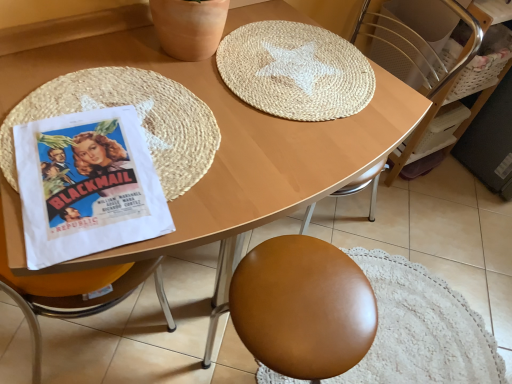
At what (x,y) coordinates should I click in order to perform the action: click on wooden at upper center. Please return your answer as a coordinate pair (x, y). Looking at the image, I should click on (417, 46).

In order to face natural fiber mat at upper center, arranged as the first mat when viewed from the right, should I rotate leftwards or rightwards?

To face it directly, rotate right by 5.818 degrees.

Locate an element on the screen. woven straw placemat at left, which ranks as the 2th mat in right-to-left order is located at coordinates (138, 116).

The width and height of the screenshot is (512, 384). I want to click on wooden at upper center, so click(x=417, y=46).

Is natural fiber mat at upper center, the second mat positioned from the left, oriented towards white woven basket at upper right?

No, natural fiber mat at upper center, the second mat positioned from the left, is not oriented towards white woven basket at upper right.

Considering the relative sizes of natural fiber mat at upper center, the second mat positioned from the left, and white woven basket at upper right in the image provided, is natural fiber mat at upper center, the second mat positioned from the left, wider than white woven basket at upper right?

Correct, the width of natural fiber mat at upper center, the second mat positioned from the left, exceeds that of white woven basket at upper right.

Is white woven basket at upper right surrounded by natural fiber mat at upper center, the second mat positioned from the left?

No, white woven basket at upper right is not inside natural fiber mat at upper center, the second mat positioned from the left.

Considering the points (305, 88) and (484, 81), which point is in front, point (305, 88) or point (484, 81)?

The point (305, 88) is closer.

Is wooden at upper center surrounded by woven straw placemat at left, the first mat from the left?

No, wooden at upper center is located outside of woven straw placemat at left, the first mat from the left.

From the image's perspective, which one is positioned higher, woven straw placemat at left, which ranks as the 2th mat in right-to-left order, or wooden at upper center?

wooden at upper center, from the image's perspective.

From their relative heights in the image, would you say white woven basket at upper right is taller or shorter than white paper poster at left?

In the image, white woven basket at upper right appears to be taller than white paper poster at left.

Looking at this image, is white woven basket at upper right looking in the opposite direction of white paper poster at left?

No, white woven basket at upper right's orientation is not away from white paper poster at left.

Can you confirm if white woven basket at upper right is positioned to the left of white paper poster at left?

No, white woven basket at upper right is not to the left of white paper poster at left.

Considering the sizes of white woven basket at upper right and white paper poster at left in the image, is white woven basket at upper right wider or thinner than white paper poster at left?

Clearly, white woven basket at upper right has less width compared to white paper poster at left.

Looking at this image, is white woven basket at upper right next to woven straw placemat at left, which ranks as the 2th mat in right-to-left order?

white woven basket at upper right is not next to woven straw placemat at left, which ranks as the 2th mat in right-to-left order, and they're not touching.

Is woven straw placemat at left, the first mat from the left, located within white woven basket at upper right?

That's incorrect, woven straw placemat at left, the first mat from the left, is not inside white woven basket at upper right.

Measure the distance from white woven basket at upper right to woven straw placemat at left, the first mat from the left.

A distance of 3.52 feet exists between white woven basket at upper right and woven straw placemat at left, the first mat from the left.

In the scene shown: How different are the orientations of white woven basket at upper right and woven straw placemat at left, which ranks as the 2th mat in right-to-left order, in degrees?

There is a 3.78-degree angle between the facing directions of white woven basket at upper right and woven straw placemat at left, which ranks as the 2th mat in right-to-left order.

Considering the relative sizes of white paper poster at left and natural fiber mat at upper center, the second mat positioned from the left, in the image provided, is white paper poster at left smaller than natural fiber mat at upper center, the second mat positioned from the left,?

Indeed, white paper poster at left has a smaller size compared to natural fiber mat at upper center, the second mat positioned from the left.

Is white paper poster at left positioned with its back to natural fiber mat at upper center, the second mat positioned from the left?

No, white paper poster at left's orientation is not away from natural fiber mat at upper center, the second mat positioned from the left.

Is white paper poster at left further to the viewer compared to natural fiber mat at upper center, arranged as the first mat when viewed from the right?

That is False.

Which object is wider, white paper poster at left or natural fiber mat at upper center, the second mat positioned from the left?

With larger width is natural fiber mat at upper center, the second mat positioned from the left.

Find the location of `basket above the white paper poster at left (from the image's perspective)`. basket above the white paper poster at left (from the image's perspective) is located at coordinates 484,63.

Which is less distant, (100, 222) or (484, 82)?

The point (100, 222) is closer to the camera.

Consider the image. Is white paper poster at left completely or partially outside of white woven basket at upper right?

Yes.

From the picture: Is white paper poster at left positioned with its back to white woven basket at upper right?

No, white paper poster at left's orientation is not away from white woven basket at upper right.

From the image's perspective, which one is positioned higher, natural fiber mat at upper center, the second mat positioned from the left, or woven straw placemat at left, the first mat from the left?

From the image's view, natural fiber mat at upper center, the second mat positioned from the left, is above.

Where is `mat below the natural fiber mat at upper center, the second mat positioned from the left (from the image's perspective)`? mat below the natural fiber mat at upper center, the second mat positioned from the left (from the image's perspective) is located at coordinates (138, 116).

Considering the sizes of objects natural fiber mat at upper center, the second mat positioned from the left, and woven straw placemat at left, which ranks as the 2th mat in right-to-left order, in the image provided, who is shorter, natural fiber mat at upper center, the second mat positioned from the left, or woven straw placemat at left, which ranks as the 2th mat in right-to-left order,?

With less height is woven straw placemat at left, which ranks as the 2th mat in right-to-left order.

Which object is closer to the camera, natural fiber mat at upper center, arranged as the first mat when viewed from the right, or woven straw placemat at left, the first mat from the left?

woven straw placemat at left, the first mat from the left, is more forward.

Find the location of a particular element. the 1st mat in front of the white woven basket at upper right is located at coordinates pos(295,71).

This screenshot has width=512, height=384. Identify the location of chair behind the woven straw placemat at left, which ranks as the 2th mat in right-to-left order. (417, 46).

Looking at the image, which one is located further to natural fiber mat at upper center, arranged as the first mat when viewed from the right, white woven basket at upper right or woven straw placemat at left, which ranks as the 2th mat in right-to-left order?

white woven basket at upper right.

When comparing their distances from white woven basket at upper right, does woven straw placemat at left, the first mat from the left, or wooden at upper center seem closer?

wooden at upper center is closer to white woven basket at upper right.

When comparing their distances from white paper poster at left, does wooden at upper center or woven straw placemat at left, which ranks as the 2th mat in right-to-left order, seem closer?

woven straw placemat at left, which ranks as the 2th mat in right-to-left order, is positioned closer to the anchor white paper poster at left.

Considering their positions, is wooden at upper center positioned further to natural fiber mat at upper center, the second mat positioned from the left, than white woven basket at upper right?

Among the two, white woven basket at upper right is located further to natural fiber mat at upper center, the second mat positioned from the left.

Looking at the image, which one is located further to natural fiber mat at upper center, arranged as the first mat when viewed from the right, woven straw placemat at left, the first mat from the left, or white paper poster at left?

white paper poster at left lies further to natural fiber mat at upper center, arranged as the first mat when viewed from the right, than the other object.

Which object lies further to the anchor point woven straw placemat at left, which ranks as the 2th mat in right-to-left order, white paper poster at left or white woven basket at upper right?

Based on the image, white woven basket at upper right appears to be further to woven straw placemat at left, which ranks as the 2th mat in right-to-left order.

Looking at the image, which one is located closer to white paper poster at left, wooden at upper center or natural fiber mat at upper center, the second mat positioned from the left?

Based on the image, natural fiber mat at upper center, the second mat positioned from the left, appears to be nearer to white paper poster at left.

Based on their spatial positions, is woven straw placemat at left, which ranks as the 2th mat in right-to-left order, or white woven basket at upper right closer to white paper poster at left?

The object closer to white paper poster at left is woven straw placemat at left, which ranks as the 2th mat in right-to-left order.

Find the location of a particular element. This screenshot has width=512, height=384. mat located between white paper poster at left and natural fiber mat at upper center, arranged as the first mat when viewed from the right, in the left-right direction is located at coordinates (138, 116).

Where is `chair located between woven straw placemat at left, which ranks as the 2th mat in right-to-left order, and white woven basket at upper right in the left-right direction`? This screenshot has width=512, height=384. chair located between woven straw placemat at left, which ranks as the 2th mat in right-to-left order, and white woven basket at upper right in the left-right direction is located at coordinates (417, 46).

You are a GUI agent. You are given a task and a screenshot of the screen. Output one action in this format:
    pyautogui.click(x=<x>, y=<y>)
    Task: Click on the chair located between natural fiber mat at upper center, the second mat positioned from the left, and white woven basket at upper right in the left-right direction
    Image resolution: width=512 pixels, height=384 pixels.
    Given the screenshot: What is the action you would take?
    pyautogui.click(x=417, y=46)

Find the location of a particular element. The image size is (512, 384). chair between white paper poster at left and white woven basket at upper right is located at coordinates (417, 46).